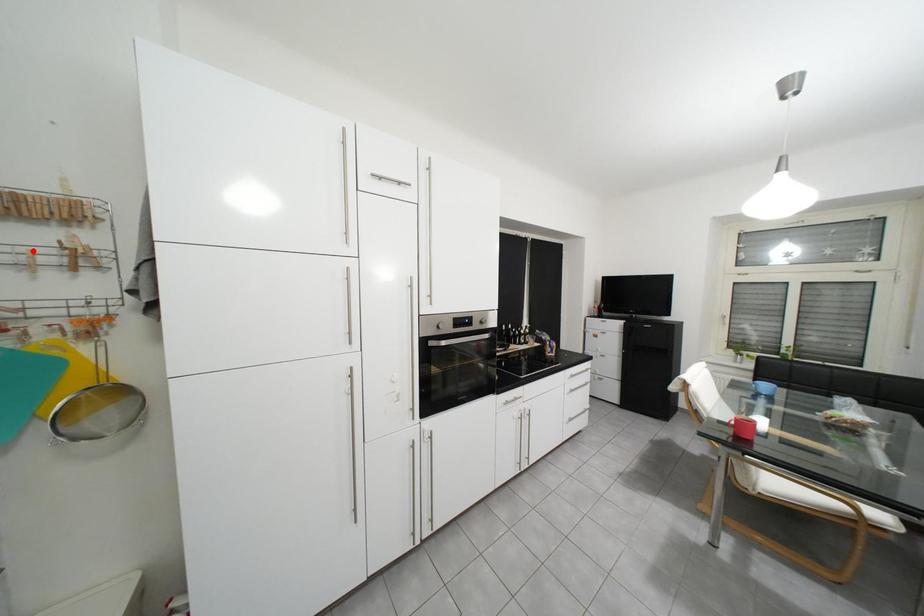
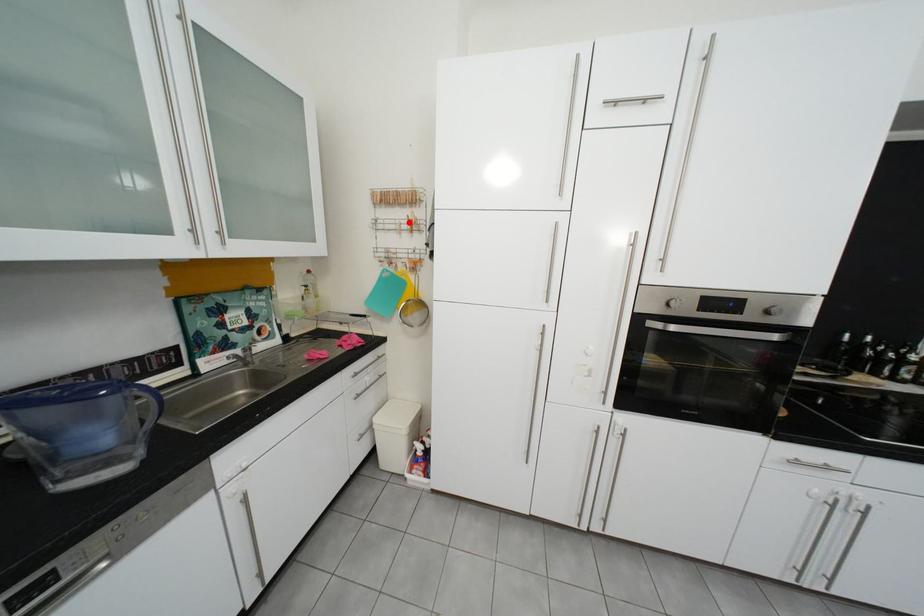
I am providing you with two images of the same scene from different viewpoints. A red point is marked on the first image and another point is marked on the second image. Does the point marked in image1 correspond to the same location as the one in image2?

Yes